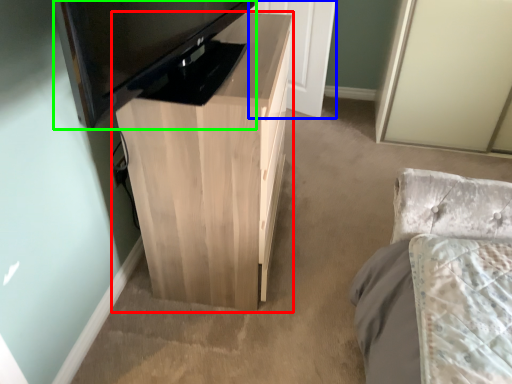
Question: Based on their relative distances, which object is farther from table (highlighted by a red box)? Choose from door (highlighted by a blue box) and television (highlighted by a green box).

Choices:
 (A) door
 (B) television

Answer: (A)